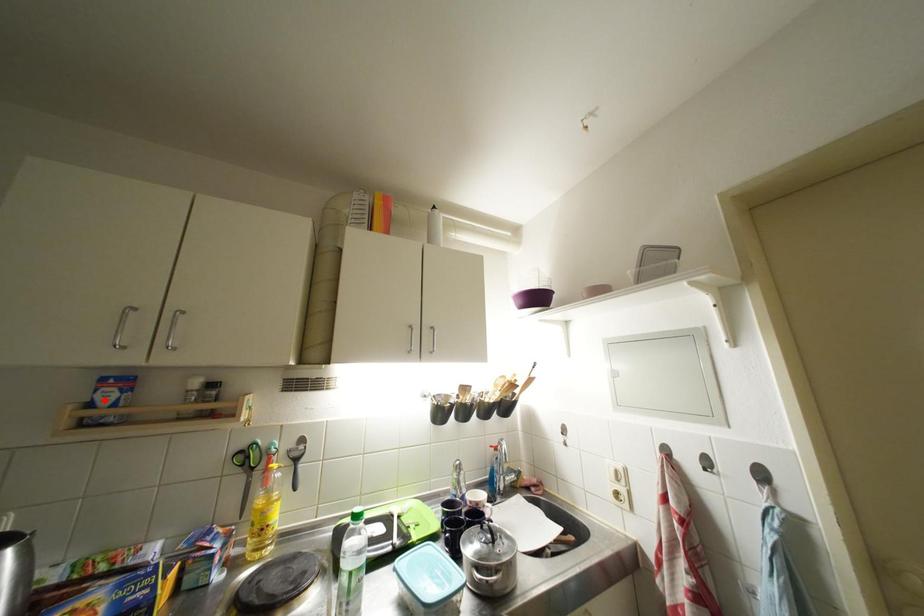
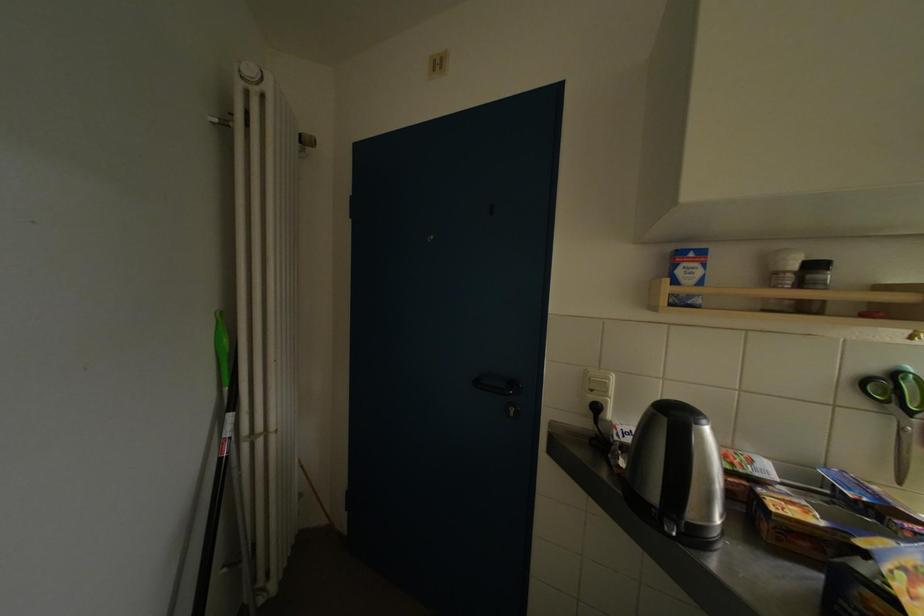
Locate, in the second image, the point that corresponds to the highlighted location in the first image.

(686, 276)